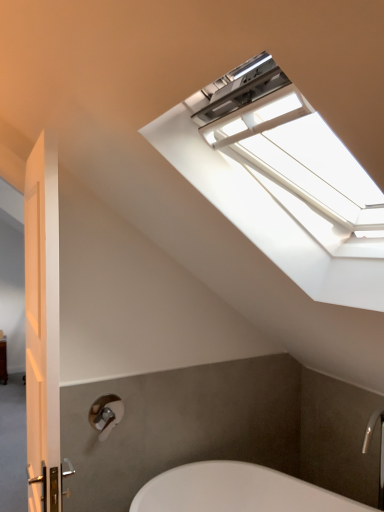
Question: From a real-world perspective, does white glossy door at left stand above silver metallic faucet at lower right?

Choices:
 (A) no
 (B) yes

Answer: (B)

Question: Does white glossy door at left turn towards silver metallic faucet at lower right?

Choices:
 (A) no
 (B) yes

Answer: (A)

Question: Is silver metallic faucet at lower right at the back of white glossy door at left?

Choices:
 (A) yes
 (B) no

Answer: (A)

Question: Is white glossy door at left to the left of silver metallic faucet at lower right from the viewer's perspective?

Choices:
 (A) yes
 (B) no

Answer: (A)

Question: Considering the relative positions of white glossy door at left and silver metallic faucet at lower right in the image provided, is white glossy door at left to the right of silver metallic faucet at lower right from the viewer's perspective?

Choices:
 (A) yes
 (B) no

Answer: (B)

Question: Is white glossy door at left closer to the viewer compared to silver metallic faucet at lower right?

Choices:
 (A) yes
 (B) no

Answer: (A)

Question: Can you confirm if white glossy door at left is smaller than white plastic window at upper center?

Choices:
 (A) no
 (B) yes

Answer: (B)

Question: Considering the relative sizes of white glossy door at left and white plastic window at upper center in the image provided, is white glossy door at left shorter than white plastic window at upper center?

Choices:
 (A) yes
 (B) no

Answer: (B)

Question: Considering the relative positions of white glossy door at left and white plastic window at upper center in the image provided, is white glossy door at left to the right of white plastic window at upper center from the viewer's perspective?

Choices:
 (A) yes
 (B) no

Answer: (B)

Question: From the image's perspective, is white glossy door at left on top of white plastic window at upper center?

Choices:
 (A) no
 (B) yes

Answer: (A)

Question: Is white glossy door at left taller than white plastic window at upper center?

Choices:
 (A) yes
 (B) no

Answer: (A)

Question: From a real-world perspective, is white glossy door at left physically below white plastic window at upper center?

Choices:
 (A) yes
 (B) no

Answer: (A)

Question: Considering the relative sizes of silver metallic faucet at lower right and white plastic window at upper center in the image provided, is silver metallic faucet at lower right wider than white plastic window at upper center?

Choices:
 (A) yes
 (B) no

Answer: (B)